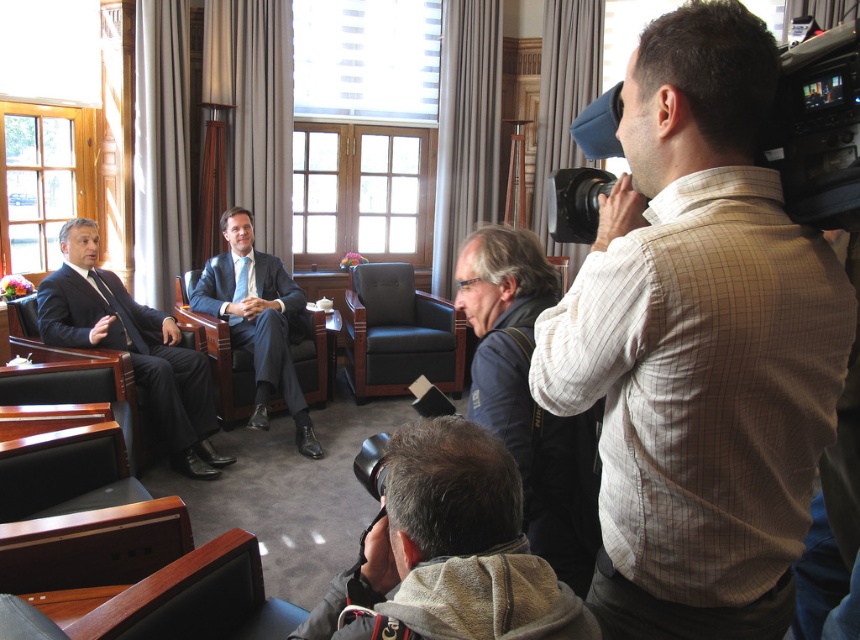
Question: Is gray fleece jacket at lower center further to the viewer compared to dark blue jacket at center?

Choices:
 (A) no
 (B) yes

Answer: (A)

Question: Which of the following is the farthest from the observer?

Choices:
 (A) matte blue suit at center
 (B) black plastic video camera at upper right
 (C) white checkered shirt at right
 (D) leather armchair at center

Answer: (D)

Question: Considering the real-world distances, which object is closest to the matte black suit at left?

Choices:
 (A) leather armchair at center
 (B) white checkered shirt at right
 (C) dark blue jacket at center

Answer: (A)

Question: Among these points, which one is farthest from the camera?

Choices:
 (A) (719, 115)
 (B) (490, 637)
 (C) (427, 298)
 (D) (198, 417)

Answer: (C)

Question: Considering the relative positions of matte blue suit at center and leather armchair at center in the image provided, where is matte blue suit at center located with respect to leather armchair at center?

Choices:
 (A) left
 (B) right

Answer: (A)

Question: Does gray fleece jacket at lower center come in front of matte blue suit at center?

Choices:
 (A) no
 (B) yes

Answer: (B)